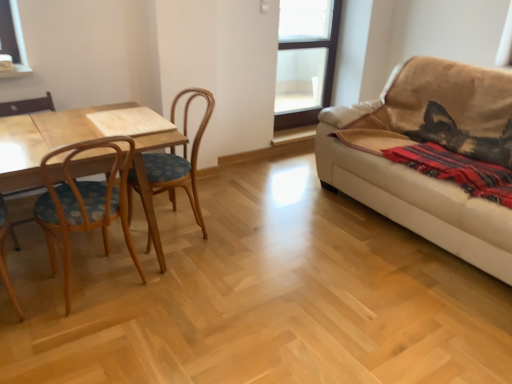
Where is `vacant area on top of wooden table at left (from a real-world perspective)`? vacant area on top of wooden table at left (from a real-world perspective) is located at coordinates (59, 129).